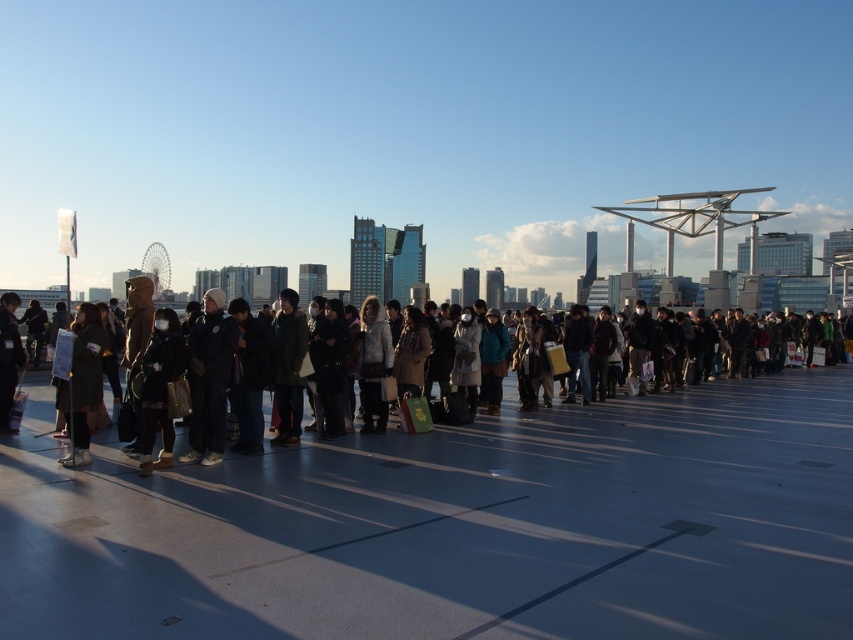
Question: Does dark gray coat at center appear over dark gray fabric jacket at center?

Choices:
 (A) yes
 (B) no

Answer: (B)

Question: Which point is farther to the camera?

Choices:
 (A) (305, 524)
 (B) (199, 394)
 (C) (22, 364)

Answer: (C)

Question: Is dark gray coat at center bigger than dark gray jacket at left?

Choices:
 (A) yes
 (B) no

Answer: (A)

Question: Among these points, which one is farthest from the camera?

Choices:
 (A) (3, 348)
 (B) (192, 376)

Answer: (A)

Question: Which point is farther from the camera taking this photo?

Choices:
 (A) (218, 371)
 (B) (230, 467)

Answer: (A)

Question: Is dark gray fabric jacket at center thinner than dark green fabric coat at left?

Choices:
 (A) yes
 (B) no

Answer: (B)